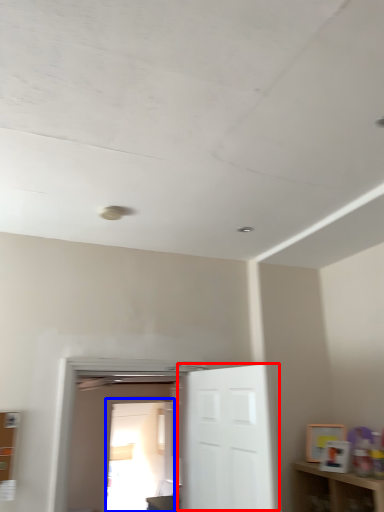
Question: Which of the following is the farthest to the observer, door (highlighted by a red box) or glass door (highlighted by a blue box)?

Choices:
 (A) door
 (B) glass door

Answer: (B)